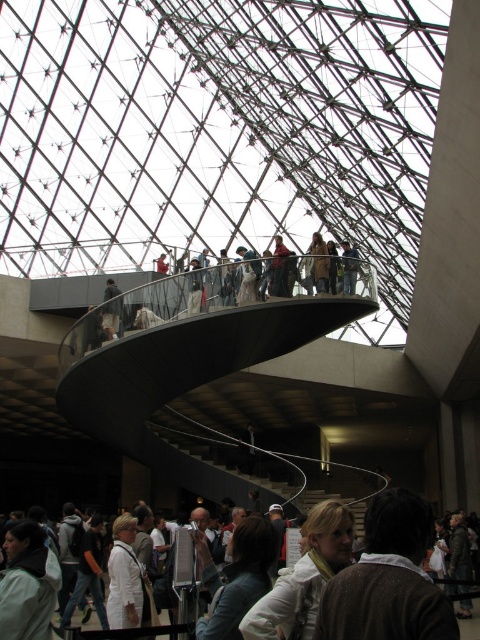
Between point (192, 516) and point (110, 337), which one is positioned behind?

The point (110, 337) is more distant.

Does white fabric scarf at center have a greater height compared to light beige fabric jacket at upper center?

Indeed, white fabric scarf at center has a greater height compared to light beige fabric jacket at upper center.

The image size is (480, 640). What do you see at coordinates (144, 518) in the screenshot? I see `white fabric scarf at center` at bounding box center [144, 518].

This screenshot has height=640, width=480. What are the coordinates of `white fabric scarf at center` in the screenshot? It's located at (144, 518).

Can you confirm if light brown hair at lower center is smaller than light beige fabric jacket at upper center?

Incorrect, light brown hair at lower center is not smaller in size than light beige fabric jacket at upper center.

Looking at this image, is light brown hair at lower center positioned at the back of light beige fabric jacket at upper center?

No, light brown hair at lower center is in front of light beige fabric jacket at upper center.

Which is in front, point (393, 548) or point (106, 333)?

Point (393, 548) is more forward.

Find the location of `light brown hair at lower center`. light brown hair at lower center is located at coordinates (388, 579).

Is light brown hair at lower center shorter than white fabric scarf at center?

Yes.

Who is taller, light brown hair at lower center or white fabric scarf at center?

white fabric scarf at center

This screenshot has width=480, height=640. What do you see at coordinates (388, 579) in the screenshot?
I see `light brown hair at lower center` at bounding box center [388, 579].

This screenshot has width=480, height=640. I want to click on light brown hair at lower center, so click(x=388, y=579).